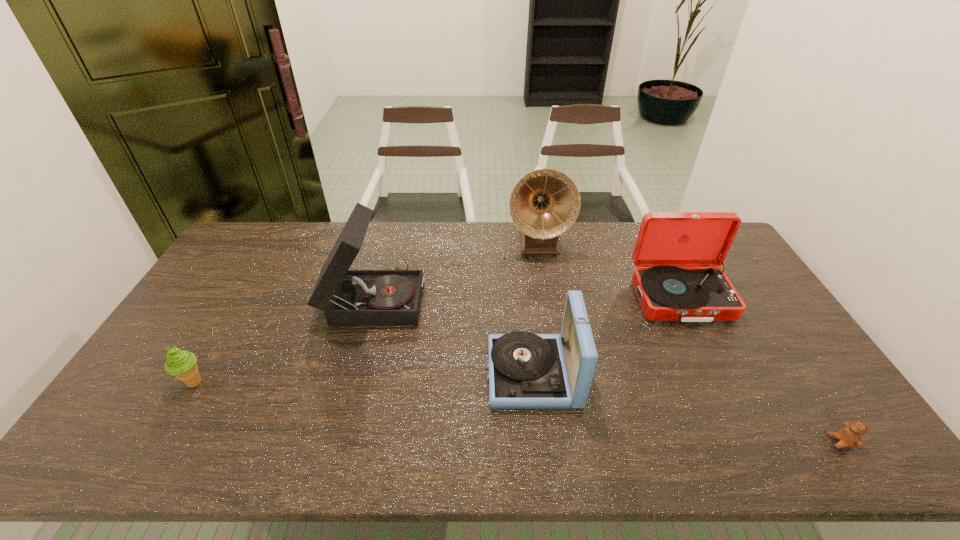
I want to click on object positioned at the left edge, so click(x=182, y=364).

Where is `phonograph_record that is positioned at the right edge`? phonograph_record that is positioned at the right edge is located at coordinates (666, 241).

I want to click on teddy bear that is positioned at the right edge, so click(851, 435).

Find the location of a particular element. This screenshot has width=960, height=540. object that is at the near right corner is located at coordinates (851, 435).

You are a GUI agent. You are given a task and a screenshot of the screen. Output one action in this format:
    pyautogui.click(x=<x>, y=<y>)
    Task: Click on the free region at the far edge of the desktop
    The width and height of the screenshot is (960, 540).
    Given the screenshot: What is the action you would take?
    click(585, 225)

You are a GUI agent. You are given a task and a screenshot of the screen. Output one action in this format:
    pyautogui.click(x=<x>, y=<y>)
    Task: Click on the free space at the near edge of the desktop
    The image size is (960, 540).
    Given the screenshot: What is the action you would take?
    pyautogui.click(x=236, y=443)

This screenshot has width=960, height=540. Identify the location of blank space at the left edge. (215, 303).

Where is `free space at the near left corner of the desktop`? This screenshot has height=540, width=960. free space at the near left corner of the desktop is located at coordinates 159,434.

Locate an element on the screen. vacant region between the fourth shortest object and the rightmost object is located at coordinates (760, 370).

Where is `vacant space that's between the farthest object and the third shortest object`? This screenshot has height=540, width=960. vacant space that's between the farthest object and the third shortest object is located at coordinates [x=535, y=308].